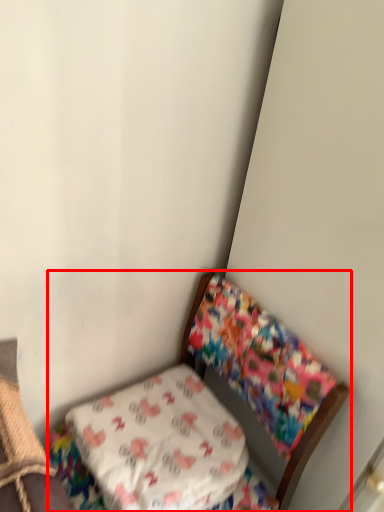
Question: From the image's perspective, what is the correct spatial relationship of furniture (annotated by the red box) in relation to pillow?

Choices:
 (A) below
 (B) above

Answer: (A)